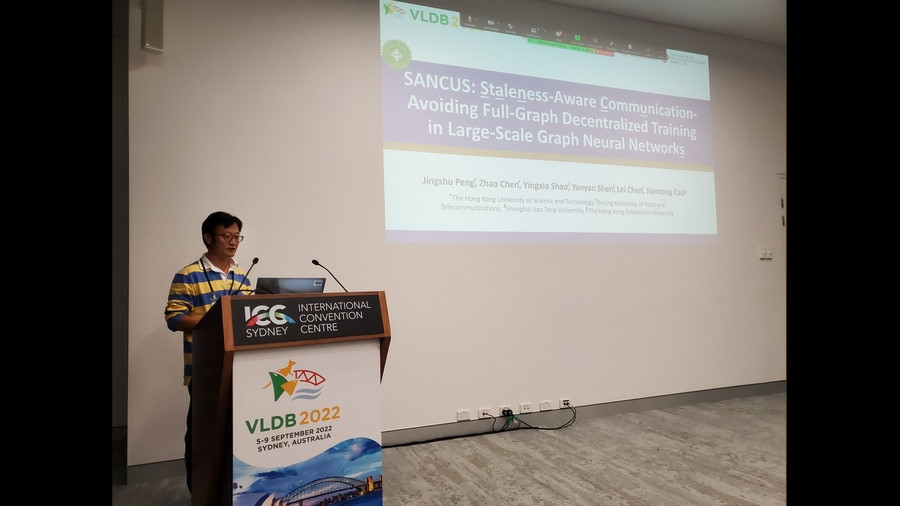
Find the location of a particular element. cables is located at coordinates (510, 416).